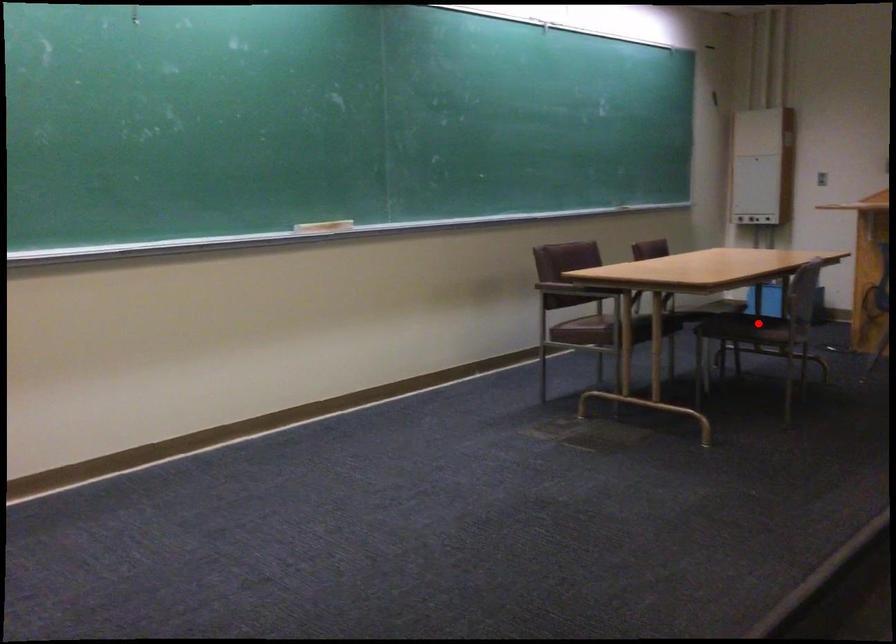
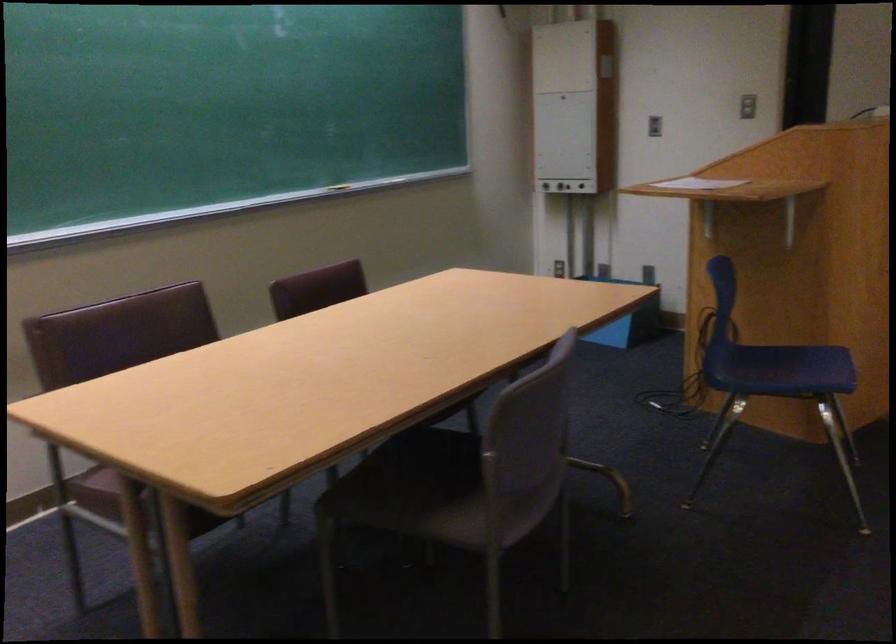
Where in the second image is the point corresponding to the highlighted location from the first image?

(454, 487)